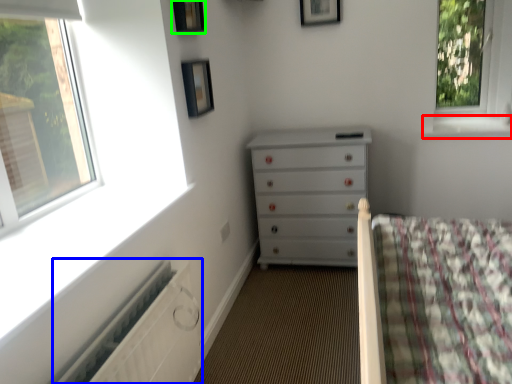
Question: Estimate the real-world distances between objects in this image. Which object is farther from window sill (highlighted by a red box), radiator (highlighted by a blue box) or picture frame (highlighted by a green box)?

Choices:
 (A) radiator
 (B) picture frame

Answer: (A)